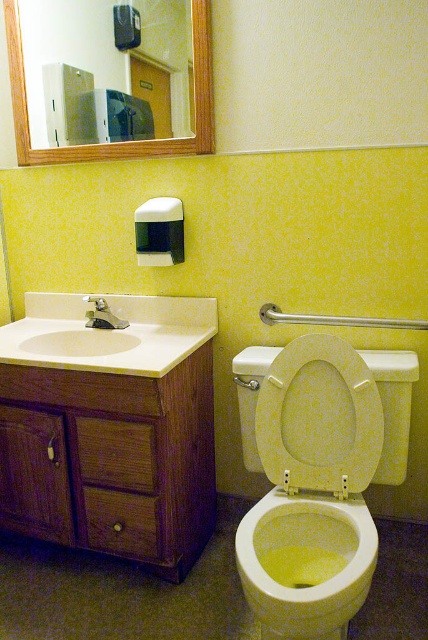
Question: Is wooden frame mirror at upper left in front of brushed metal faucet at sink left?

Choices:
 (A) yes
 (B) no

Answer: (A)

Question: Estimate the real-world distances between objects in this image. Which object is farther from the brushed metal faucet at sink left?

Choices:
 (A) white glossy sink at left
 (B) wooden frame mirror at upper left

Answer: (B)

Question: Among these points, which one is nearest to the camera?

Choices:
 (A) (407, 428)
 (B) (175, 333)

Answer: (A)

Question: In this image, where is yellow matte toilet bowl at center located relative to brushed metal faucet at sink left?

Choices:
 (A) below
 (B) above

Answer: (A)

Question: Can you confirm if yellow speckled plastic toilet seat at center is wider than white glossy sink at left?

Choices:
 (A) yes
 (B) no

Answer: (B)

Question: Which point is closer to the camera taking this photo?

Choices:
 (A) (362, 401)
 (B) (240, 392)
 (C) (107, 353)

Answer: (A)